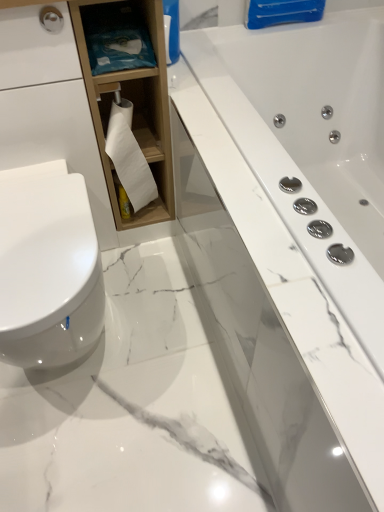
Question: From a real-world perspective, is white marble bathtub at center on white matte toilet paper at center?

Choices:
 (A) no
 (B) yes

Answer: (A)

Question: Is white marble bathtub at center far away from white matte toilet paper at center?

Choices:
 (A) yes
 (B) no

Answer: (B)

Question: Is white marble bathtub at center at the left side of white matte toilet paper at center?

Choices:
 (A) yes
 (B) no

Answer: (B)

Question: Is white marble bathtub at center next to white matte toilet paper at center and touching it?

Choices:
 (A) no
 (B) yes

Answer: (A)

Question: Does white marble bathtub at center have a smaller size compared to white matte toilet paper at center?

Choices:
 (A) no
 (B) yes

Answer: (A)

Question: Can you confirm if white marble bathtub at center is bigger than white matte toilet paper at center?

Choices:
 (A) no
 (B) yes

Answer: (B)

Question: Is blue fabric at upper left closer to the viewer compared to white marble bathtub at center?

Choices:
 (A) yes
 (B) no

Answer: (B)

Question: From a real-world perspective, is blue fabric at upper left located higher than white marble bathtub at center?

Choices:
 (A) yes
 (B) no

Answer: (A)

Question: Is blue fabric at upper left thinner than white marble bathtub at center?

Choices:
 (A) no
 (B) yes

Answer: (B)

Question: Is blue fabric at upper left oriented away from white marble bathtub at center?

Choices:
 (A) no
 (B) yes

Answer: (A)

Question: Can you confirm if blue fabric at upper left is positioned to the left of white marble bathtub at center?

Choices:
 (A) yes
 (B) no

Answer: (A)

Question: Is blue fabric at upper left in contact with white marble bathtub at center?

Choices:
 (A) no
 (B) yes

Answer: (A)

Question: Is white glossy toilet at left positioned beyond the bounds of blue fabric at upper left?

Choices:
 (A) no
 (B) yes

Answer: (B)